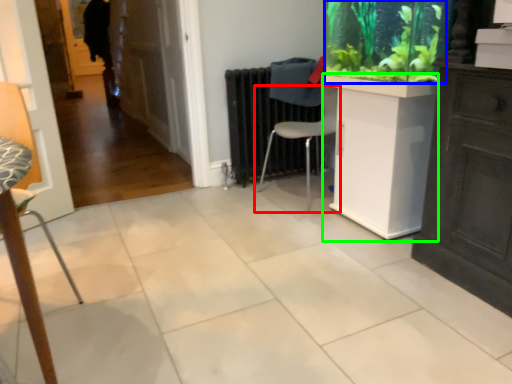
Question: Considering the real-world distances, which object is farthest from chair (highlighted by a red box)? plant (highlighted by a blue box) or counter (highlighted by a green box)?

Choices:
 (A) plant
 (B) counter

Answer: (A)